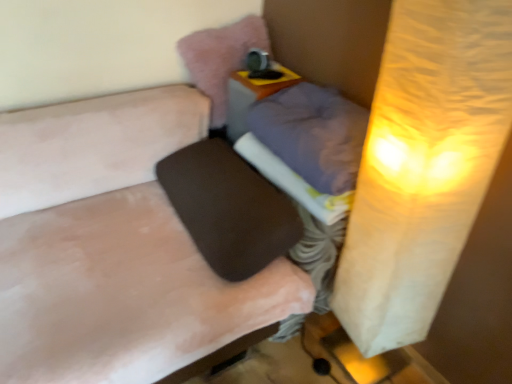
Question: Could purple fabric pillow at center, which is the 2th pillow from top to bottom, be considered to be inside white fabric at center?

Choices:
 (A) no
 (B) yes

Answer: (A)

Question: Is white fabric at center facing towards purple fabric pillow at center, the first pillow ordered from the bottom?

Choices:
 (A) no
 (B) yes

Answer: (A)

Question: From a real-world perspective, is white fabric at center beneath purple fabric pillow at center, the first pillow ordered from the bottom?

Choices:
 (A) no
 (B) yes

Answer: (B)

Question: From the image's perspective, is white fabric at center below purple fabric pillow at center, the first pillow ordered from the bottom?

Choices:
 (A) no
 (B) yes

Answer: (B)

Question: Is white fabric at center located outside purple fabric pillow at center, which is the 2th pillow from top to bottom?

Choices:
 (A) yes
 (B) no

Answer: (A)

Question: Looking at the image, does pink plush pillow at upper center, which is counted as the first pillow, starting from the top, seem bigger or smaller compared to brown matte speaker at center?

Choices:
 (A) small
 (B) big

Answer: (A)

Question: Considering the positions of point (229, 39) and point (59, 349), is point (229, 39) closer or farther from the camera than point (59, 349)?

Choices:
 (A) closer
 (B) farther

Answer: (B)

Question: In terms of width, does pink plush pillow at upper center, which is counted as the first pillow, starting from the top, look wider or thinner when compared to brown matte speaker at center?

Choices:
 (A) thin
 (B) wide

Answer: (A)

Question: From a real-world perspective, is pink plush pillow at upper center, the 2th pillow positioned from the bottom, physically located above or below brown matte speaker at center?

Choices:
 (A) below
 (B) above

Answer: (B)

Question: From their relative heights in the image, would you say purple fabric pillow at center, the first pillow ordered from the bottom, is taller or shorter than brown matte speaker at center?

Choices:
 (A) short
 (B) tall

Answer: (A)

Question: Is purple fabric pillow at center, which is the 2th pillow from top to bottom, bigger or smaller than brown matte speaker at center?

Choices:
 (A) big
 (B) small

Answer: (B)

Question: Choose the correct answer: Is purple fabric pillow at center, which is the 2th pillow from top to bottom, inside brown matte speaker at center or outside it?

Choices:
 (A) outside
 (B) inside

Answer: (A)

Question: Considering the positions of point [x=324, y=180] and point [x=146, y=162], is point [x=324, y=180] closer or farther from the camera than point [x=146, y=162]?

Choices:
 (A) farther
 (B) closer

Answer: (B)

Question: From the image's perspective, is white fabric at center above or below brown matte speaker at center?

Choices:
 (A) below
 (B) above

Answer: (B)

Question: Considering the relative positions of white fabric at center and brown matte speaker at center in the image provided, is white fabric at center to the left or to the right of brown matte speaker at center?

Choices:
 (A) right
 (B) left

Answer: (A)